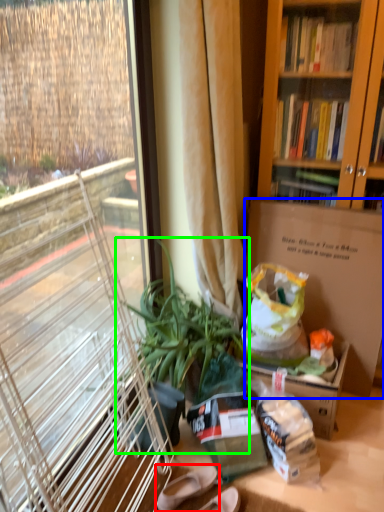
Question: Based on their relative distances, which object is nearer to footwear (highlighted by a red box)? Choose from box (highlighted by a blue box) and houseplant (highlighted by a green box).

Choices:
 (A) box
 (B) houseplant

Answer: (B)